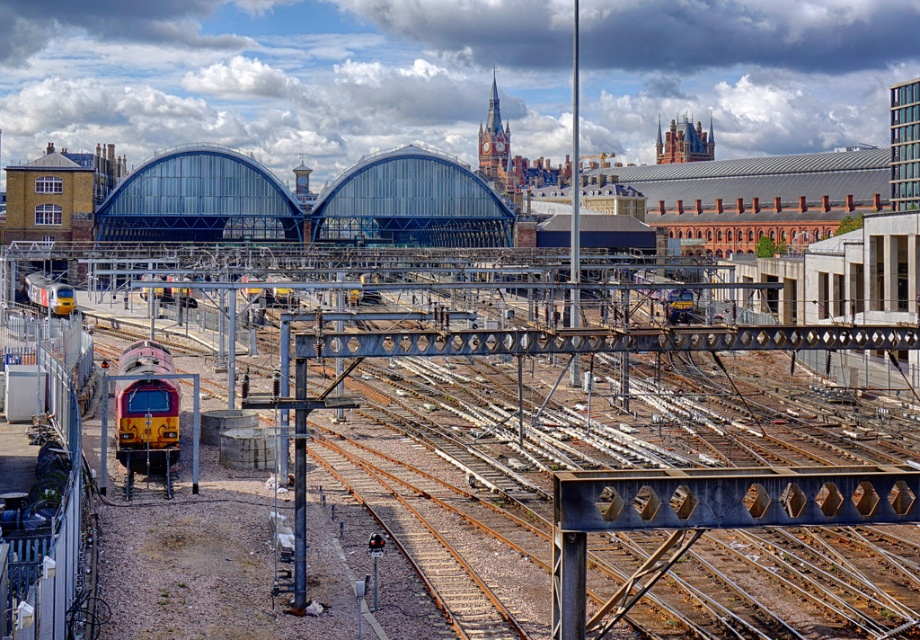
From the picture: You are standing at the station and want to determine the relative positions of two points marked in the image. Which point is nearer to you, point 1 at coordinates point (153, 417) or point 2 at coordinates point (40, 300)?

Point (153, 417) is closer to the viewer than point (40, 300).

You are standing at the railway station and want to reach a specific point marked as point (151, 440). Given that this point is 56.53 meters away from you, can you estimate how far you need to walk to reach it?

The point (151, 440) is 56.53 meters away from the viewer, so you need to walk approximately 56.53 meters to reach it.